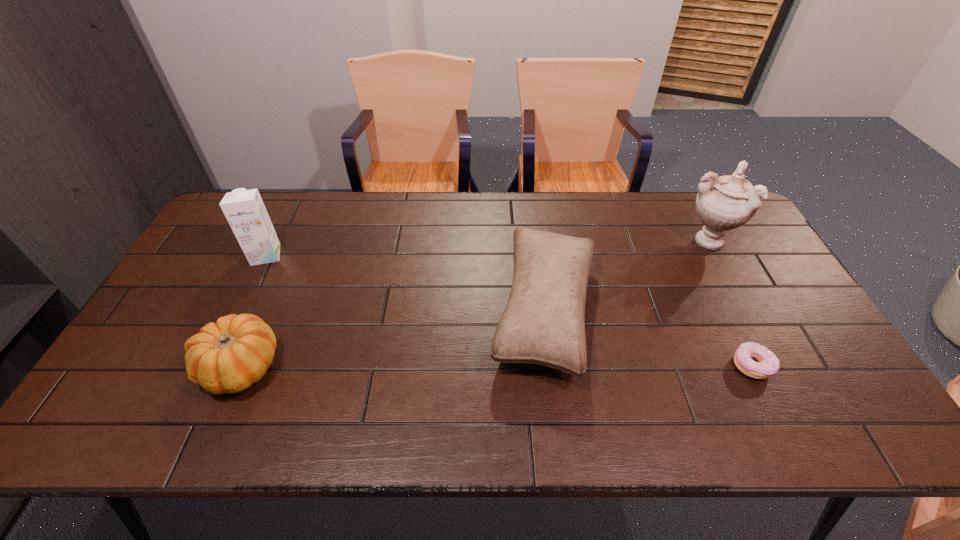
At what (x,y) coordinates should I click in order to perform the action: click on free spot between the third object from right to left and the second shortest object. Please return your answer as a coordinate pair (x, y). The image size is (960, 540). Looking at the image, I should click on (393, 339).

The image size is (960, 540). Identify the location of free space that is in between the gourd and the third object from left to right. (393, 339).

Find the location of a particular element. This screenshot has height=540, width=960. vacant space in between the third object from right to left and the gourd is located at coordinates (393, 339).

I want to click on vacant point located between the gourd and the shortest object, so click(x=496, y=367).

I want to click on empty space that is in between the urn and the third tallest object, so click(625, 276).

Where is `free space between the fourth tallest object and the carton`? free space between the fourth tallest object and the carton is located at coordinates (253, 311).

Where is `empty location between the second shortest object and the carton`? empty location between the second shortest object and the carton is located at coordinates (253, 311).

Find the location of a particular element. vacant space that is in between the third tallest object and the carton is located at coordinates (405, 283).

You are a GUI agent. You are given a task and a screenshot of the screen. Output one action in this format:
    pyautogui.click(x=<x>, y=<y>)
    Task: Click on the object identified as the fourth closest to the doughnut
    Image resolution: width=960 pixels, height=540 pixels.
    Given the screenshot: What is the action you would take?
    pyautogui.click(x=244, y=210)

Choose which object is the third nearest neighbor to the shortest object. Please provide its 2D coordinates. Your answer should be formatted as a tuple, i.e. [(x, y)], where the tuple contains the x and y coordinates of a point satisfying the conditions above.

[(229, 356)]